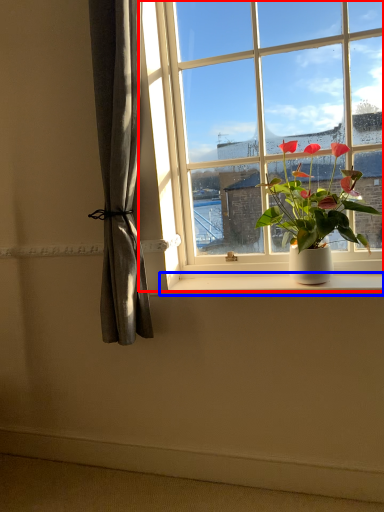
Question: Among these objects, which one is nearest to the camera, window (highlighted by a red box) or window sill (highlighted by a blue box)?

Choices:
 (A) window
 (B) window sill

Answer: (A)